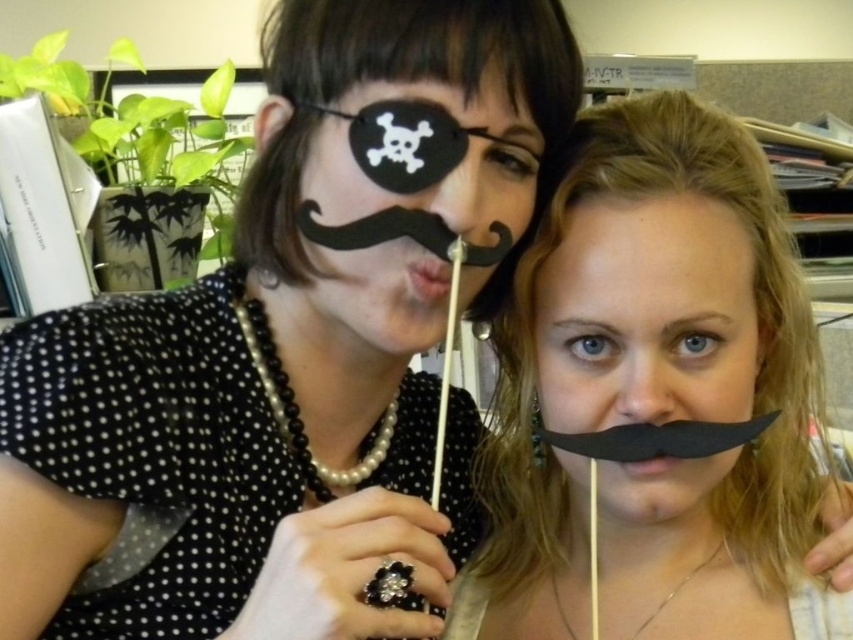
What do you see at coordinates (654, 397) in the screenshot? I see `black paper mustache at upper center` at bounding box center [654, 397].

Is black paper mustache at upper center shorter than black paper mustache at center?

In fact, black paper mustache at upper center may be taller than black paper mustache at center.

Between point (764, 480) and point (372, 88), which one is positioned behind?

Point (764, 480)

The width and height of the screenshot is (853, 640). Find the location of `black paper mustache at upper center`. black paper mustache at upper center is located at coordinates (654, 397).

Which of these two, black matte mustache at center or black paper mustache at center, stands shorter?

black paper mustache at center is shorter.

Which is more to the left, black matte mustache at center or black paper mustache at center?

Positioned to the left is black paper mustache at center.

Is point (648, 497) positioned in front of point (328, 184)?

No, it is behind (328, 184).

Where is `black matte mustache at center`? The height and width of the screenshot is (640, 853). black matte mustache at center is located at coordinates [646, 314].

Who is shorter, black paper mustache at upper center or black matte mustache at center?

With less height is black matte mustache at center.

Is black paper mustache at upper center shorter than black matte mustache at center?

Incorrect, black paper mustache at upper center's height does not fall short of black matte mustache at center's.

Is point (779, 301) positioned in front of point (746, 241)?

No.

Where is `black paper mustache at upper center`? This screenshot has height=640, width=853. black paper mustache at upper center is located at coordinates (654, 397).